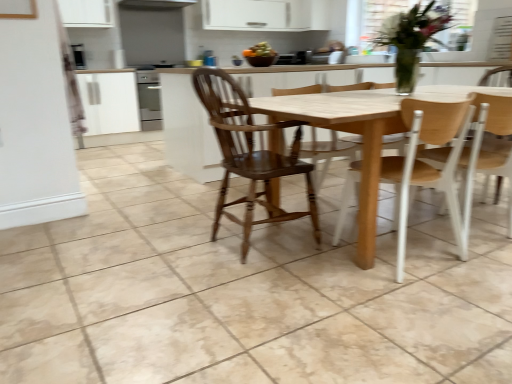
You are a GUI agent. You are given a task and a screenshot of the screen. Output one action in this format:
    pyautogui.click(x=<x>, y=<y>)
    Task: Click on the free area in between wooden chair at center, which is the 2th chair from right to left, and wooden chair at center, acting as the first chair starting from the left
    This screenshot has height=384, width=512.
    Given the screenshot: What is the action you would take?
    pyautogui.click(x=318, y=254)